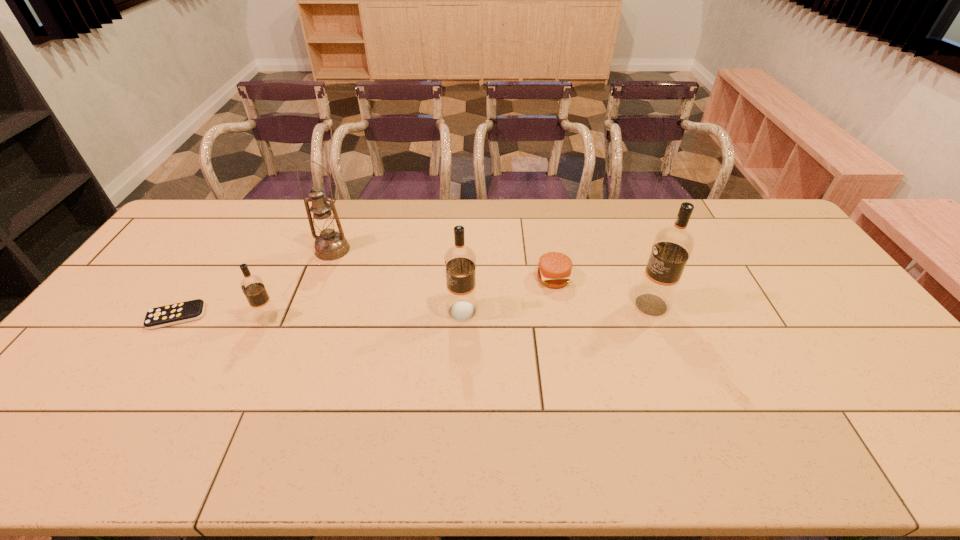
Locate an element on the screen. Image resolution: width=960 pixels, height=540 pixels. the leftmost object is located at coordinates (182, 312).

In order to click on vacant space located 0.160m on the label of the leftmost vodka in this screenshot , I will do `click(201, 318)`.

Image resolution: width=960 pixels, height=540 pixels. I want to click on vacant space located on the label of the leftmost vodka, so click(x=235, y=318).

At what (x,y) coordinates should I click in order to perform the action: click on vacant area situated 0.290m on the label of the leftmost vodka. Please return your answer as a coordinate pair (x, y). This screenshot has width=960, height=540. Looking at the image, I should click on (155, 318).

The image size is (960, 540). Identify the location of vacant space located on the label of the second shortest vodka. (363, 311).

Where is `vacant space located on the label of the second shortest vodka`? vacant space located on the label of the second shortest vodka is located at coordinates (319, 311).

Where is `blank space located 0.100m on the label of the second shortest vodka`? blank space located 0.100m on the label of the second shortest vodka is located at coordinates (412, 311).

Where is `blank space located on the label of the rightmost object`? The height and width of the screenshot is (540, 960). blank space located on the label of the rightmost object is located at coordinates (602, 305).

The image size is (960, 540). I want to click on free space located on the label of the rightmost object, so click(595, 305).

The width and height of the screenshot is (960, 540). I want to click on free spot located 0.200m on the label of the rightmost object, so click(x=564, y=305).